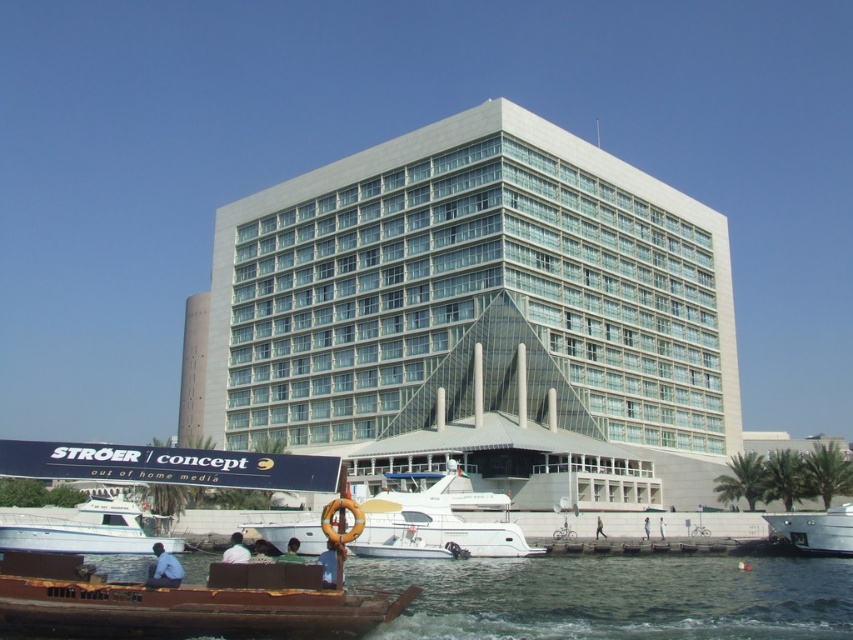
Question: Does light blue shirt at lower center have a lesser width compared to green fabric shirt at lower center?

Choices:
 (A) no
 (B) yes

Answer: (A)

Question: Among these points, which one is nearest to the camera?

Choices:
 (A) (647, 522)
 (B) (328, 568)
 (C) (601, 532)
 (D) (287, 557)

Answer: (B)

Question: Is metallic silver boat at lower right smaller than light blue denim jeans at lower center?

Choices:
 (A) yes
 (B) no

Answer: (A)

Question: Estimate the real-world distances between objects in this image. Which object is farther from the white glossy boat at center?

Choices:
 (A) skinny jeans at lower center
 (B) metallic silver boat at lower right
 (C) light blue denim jeans at lower center

Answer: (B)

Question: Among these objects, which one is farthest from the camera?

Choices:
 (A) white fabric shirt at lower center
 (B) brown wooden boat at lower left

Answer: (A)

Question: Is light blue shirt at lower center to the right of light blue fabric shirt at lower center from the viewer's perspective?

Choices:
 (A) yes
 (B) no

Answer: (B)